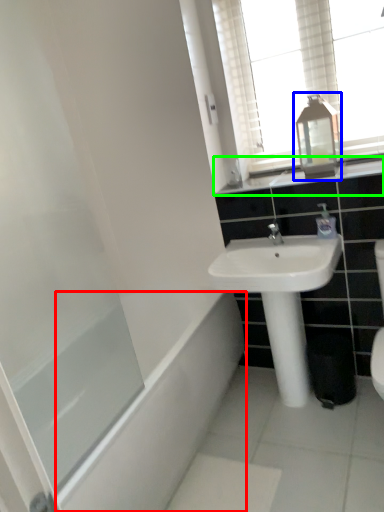
Question: Estimate the real-world distances between objects in this image. Which object is closer to bath (highlighted by a red box), medicine cabinet (highlighted by a blue box) or bathroom cabinet (highlighted by a green box)?

Choices:
 (A) medicine cabinet
 (B) bathroom cabinet

Answer: (B)